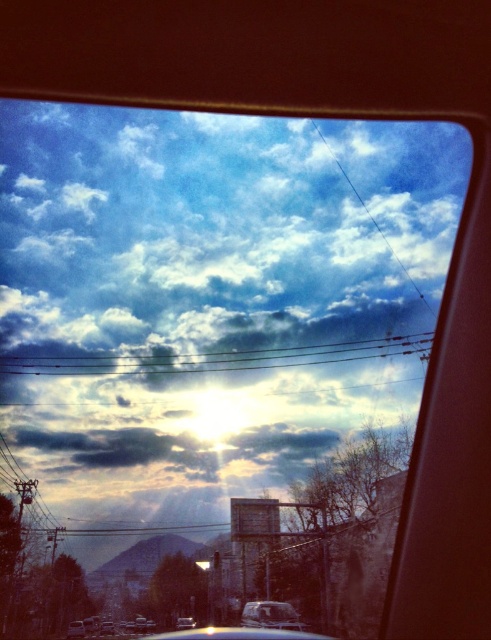
You are a photographer trying to capture the vehicles in the scene. If you want to ensure both the matte silver van at center and the matte silver car at lower left are fully visible in your photo, which vehicle should you focus on first to avoid cropping the taller one?

The matte silver van at center is taller than the matte silver car at lower left, so you should focus on the matte silver van at center first to ensure it is fully visible and avoid cropping the taller vehicle.

You are a passenger in the matte silver van at center and want to exit the vehicle through the passenger side door. Is the matte silver car at lower left blocking your path?

The matte silver van at center is positioned on the right side of the matte silver car at lower left, so the matte silver car at lower left is to the left of the matte silver van at center. Therefore, the matte silver car at lower left is not blocking the passenger side door of the matte silver van at center.